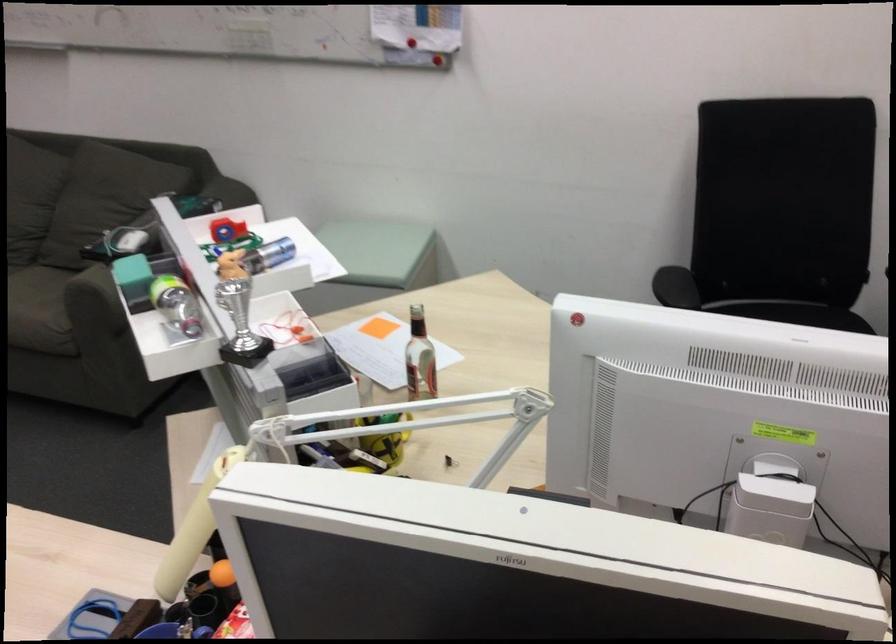
The image size is (896, 644). Describe the element at coordinates (39, 308) in the screenshot. I see `a sofa sitting surface` at that location.